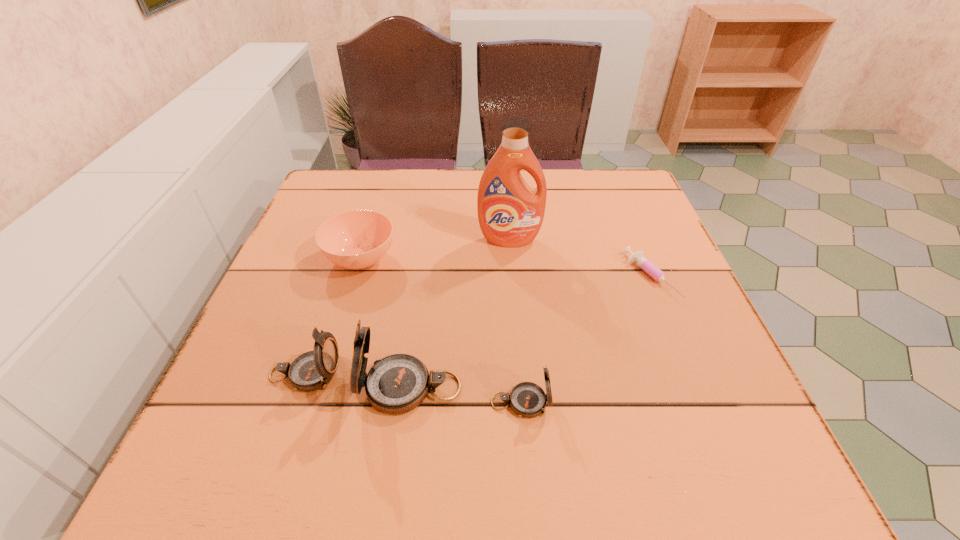
In the current image, all compasss are evenly spaced. To maintain this equal spacing, where should an additional compass be placed on the right? Please point out a free spot. Please provide its 2D coordinates. Your answer should be formatted as a tuple, i.e. [(x, y)], where the tuple contains the x and y coordinates of a point satisfying the conditions above.

[(637, 417)]